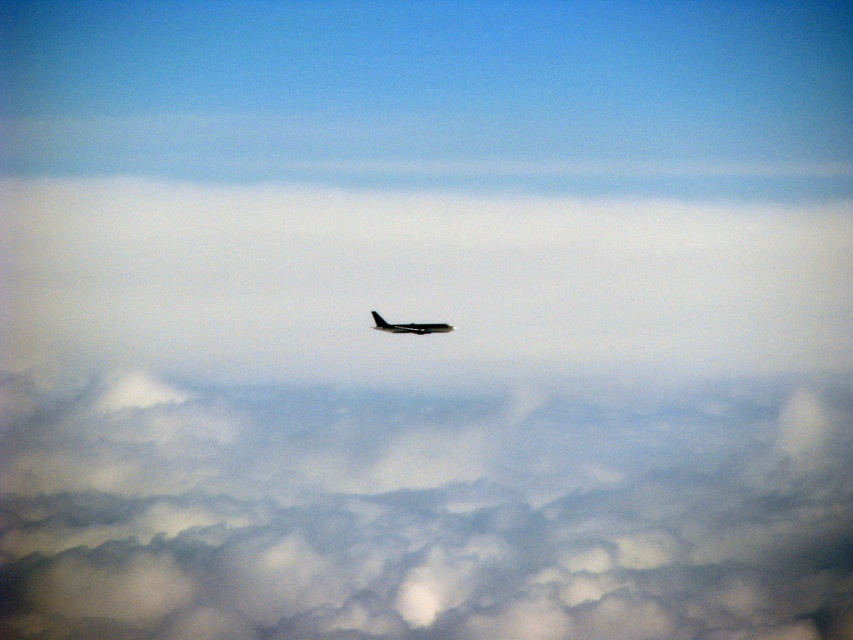
Question: Can you confirm if cloudy white at center is positioned to the left of metallic airplane at center?

Choices:
 (A) no
 (B) yes

Answer: (A)

Question: Can you confirm if cloudy white at center is positioned to the left of metallic airplane at center?

Choices:
 (A) no
 (B) yes

Answer: (A)

Question: Where is cloudy white at center located in relation to metallic airplane at center in the image?

Choices:
 (A) above
 (B) below

Answer: (B)

Question: Which point appears farthest from the camera in this image?

Choices:
 (A) (51, 630)
 (B) (422, 330)

Answer: (A)